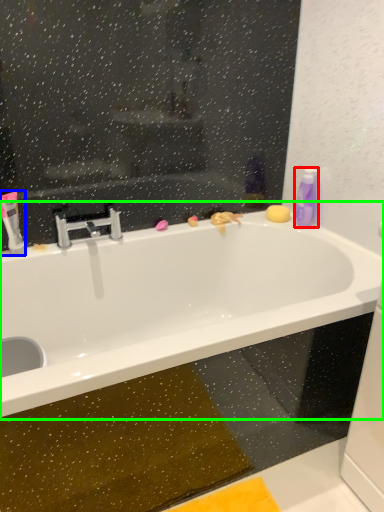
Question: Estimate the real-world distances between objects in this image. Which object is closer to cleaning product (highlighted by a red box), mouthwash (highlighted by a blue box) or bathtub (highlighted by a green box)?

Choices:
 (A) mouthwash
 (B) bathtub

Answer: (B)